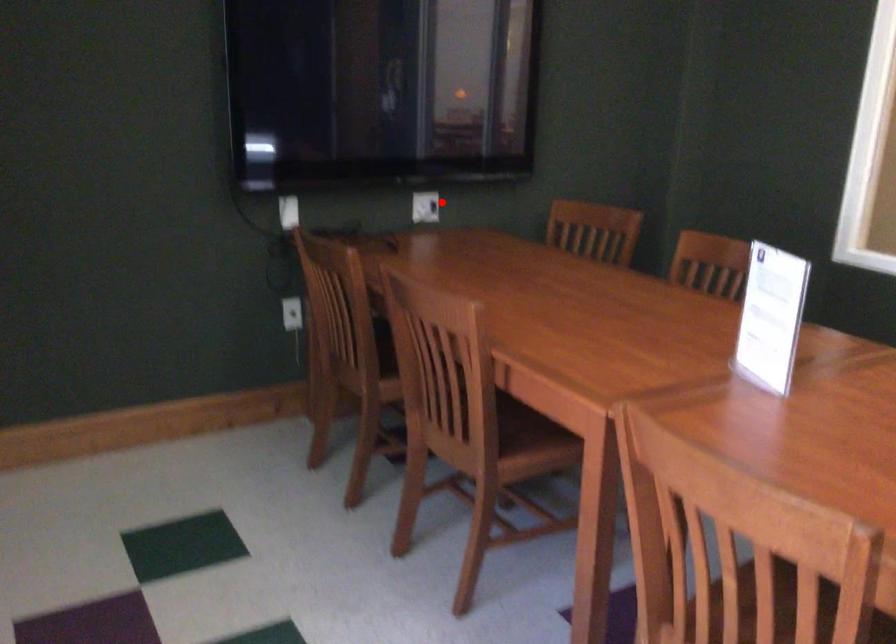
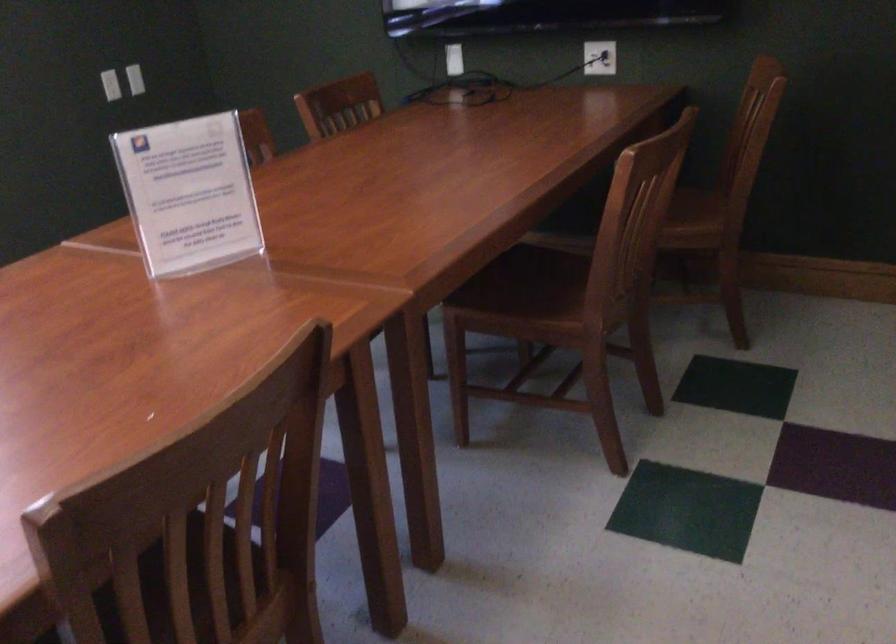
The point at the highlighted location is marked in the first image. Where is the corresponding point in the second image?

(599, 58)